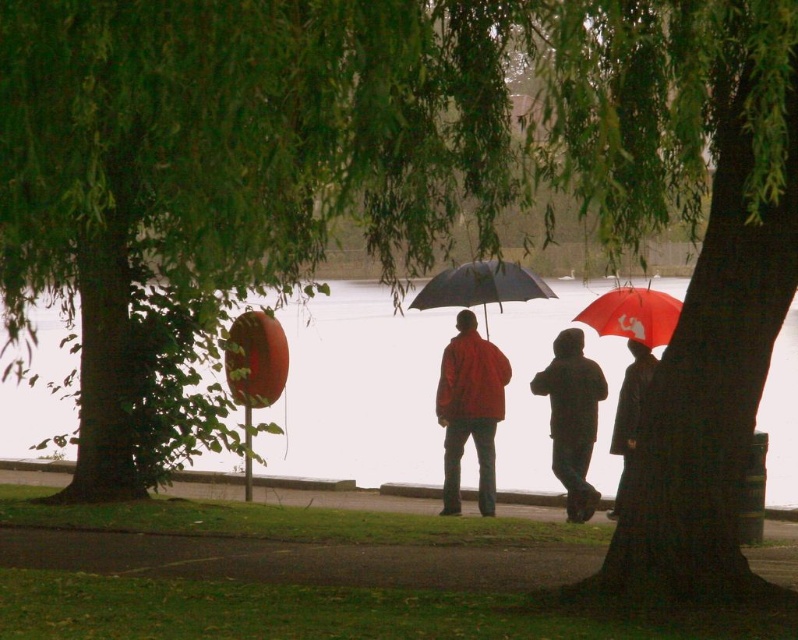
Question: Which object appears farthest from the camera in this image?

Choices:
 (A) red matte umbrella at center
 (B) matte black umbrella at center

Answer: (A)

Question: Among these points, which one is nearest to the camera?

Choices:
 (A) 598,304
 (B) 453,444

Answer: (B)

Question: Is matte red jacket at center positioned in front of dark brown hooded coat at center?

Choices:
 (A) yes
 (B) no

Answer: (B)

Question: Is matte black umbrella at center below dark matte coat at center?

Choices:
 (A) no
 (B) yes

Answer: (A)

Question: Considering the relative positions of dark brown hooded coat at center and dark matte coat at center in the image provided, where is dark brown hooded coat at center located with respect to dark matte coat at center?

Choices:
 (A) above
 (B) below

Answer: (A)

Question: Which point is farther to the camera?

Choices:
 (A) (627, 285)
 (B) (439, 276)

Answer: (A)